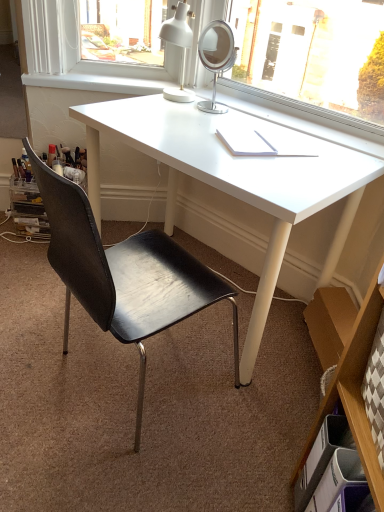
Question: From a real-world perspective, is white plastic drawer at lower right positioned above or below black leather chair at center?

Choices:
 (A) below
 (B) above

Answer: (A)

Question: Is white plastic drawer at lower right situated inside black leather chair at center or outside?

Choices:
 (A) outside
 (B) inside

Answer: (A)

Question: Which is nearer to the white plastic drawer at lower right?

Choices:
 (A) white glossy desk at center
 (B) white smooth window sill at upper center
 (C) brown cardboard bookshelf at lower right
 (D) black leather chair at center

Answer: (C)

Question: Estimate the real-world distances between objects in this image. Which object is closer to the white smooth window sill at upper center?

Choices:
 (A) white glossy desk at center
 (B) black leather chair at center
 (C) brown cardboard bookshelf at lower right
 (D) white plastic drawer at lower right

Answer: (A)